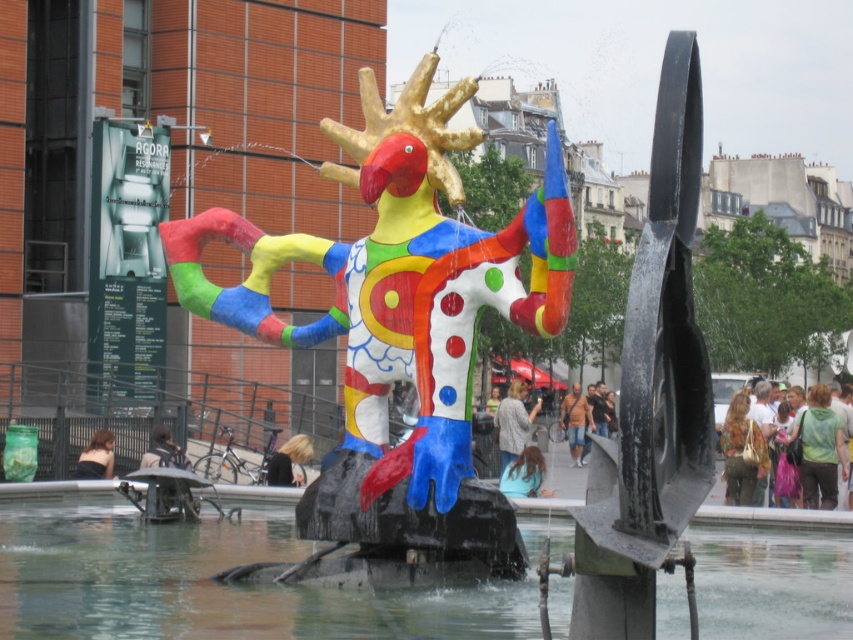
You are standing in front of the sculpture and want to take a photo of both the clear water at fountain center and the blonde hair at center. Which object should you focus on first to ensure both are in focus?

The clear water at fountain center is closer to the viewer than the blonde hair at center. To ensure both are in focus, you should focus on the clear water at fountain center first, as it is the closer object.

You are a photographer trying to capture the sculpture from a specific angle. You notice two distinct hair sections on the sculpture at the center. Which hair section, the blue fabric hair at center or the blonde hair at center, is wider?

The blue fabric hair at center is wider than the blonde hair at center according to the description.

You are trying to decide which piece of clothing to take with you. Given that the matte gray sweater at center and the light brown leather jacket at center are both at the center of the sculpture, which one would you need to move more to the side to make space for the other?

Since the matte gray sweater at center is wider than the light brown leather jacket at center, you would need to move the matte gray sweater at center more to the side to make space for the other.